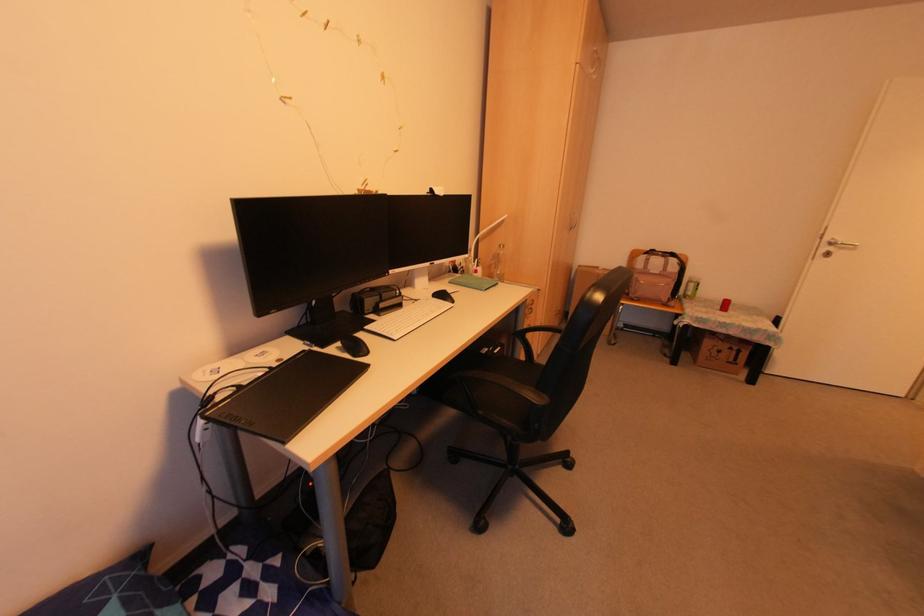
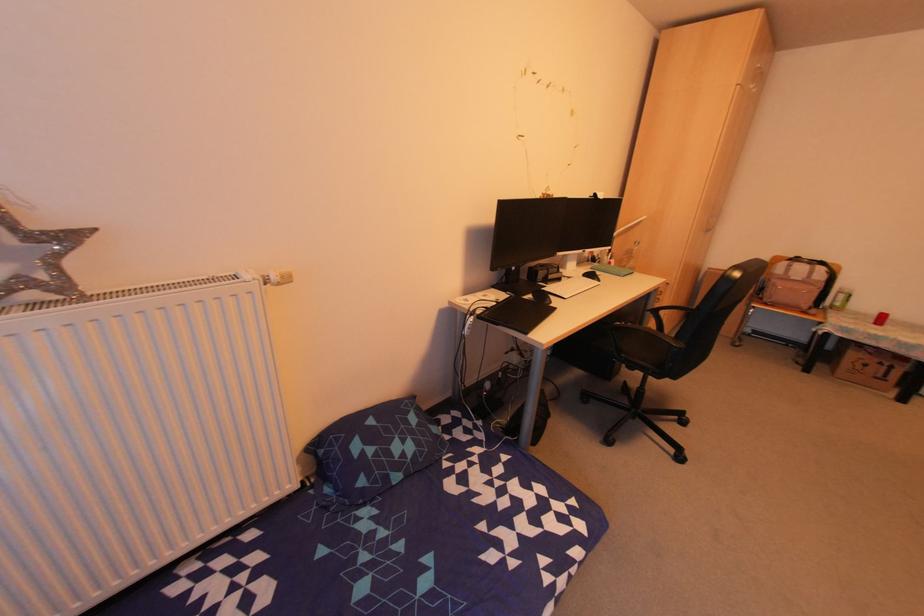
The images are taken continuously from a first-person perspective. In which direction are you moving?

The cameraman walked toward left, backward.